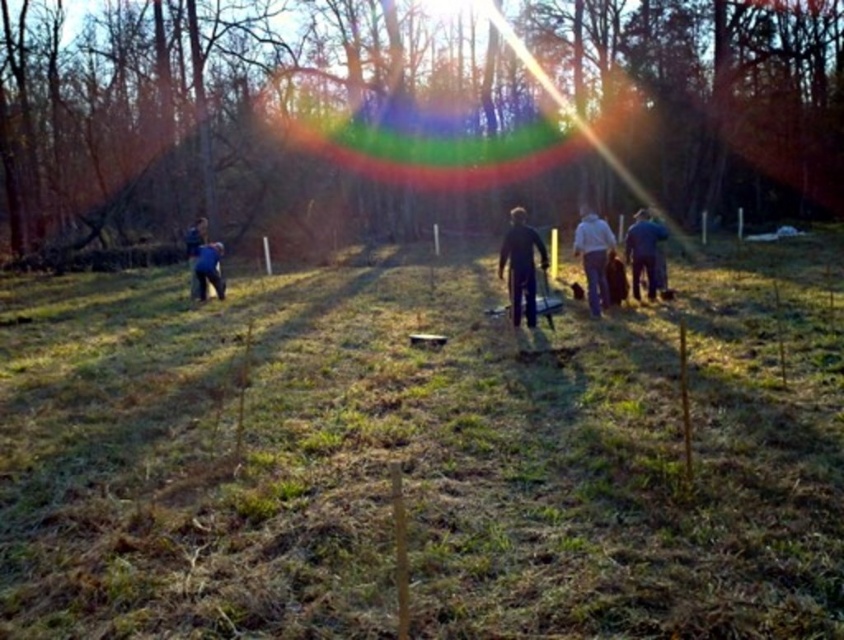
Is point (116, 573) farther from camera compared to point (464, 17)?

No, it is not.

This screenshot has height=640, width=844. What are the coordinates of `green grass at center` in the screenshot? It's located at (422, 456).

The height and width of the screenshot is (640, 844). I want to click on green grass at center, so click(x=422, y=456).

Is green matte tree at center thinner than white cotton shirt at center?

No.

Who is more forward, (377, 93) or (594, 216)?

Point (594, 216) is more forward.

You are a GUI agent. You are given a task and a screenshot of the screen. Output one action in this format:
    pyautogui.click(x=<x>, y=<y>)
    Task: Click on the green matte tree at center
    The height and width of the screenshot is (640, 844).
    Given the screenshot: What is the action you would take?
    pyautogui.click(x=412, y=113)

Does green grass at center have a greater width compared to blue fabric at left?

Correct, the width of green grass at center exceeds that of blue fabric at left.

Does point (464, 483) come in front of point (190, 237)?

Yes, point (464, 483) is in front of point (190, 237).

Is point (798, 524) closer to camera compared to point (193, 236)?

Yes, point (798, 524) is in front of point (193, 236).

Where is `green grass at center`? This screenshot has width=844, height=640. green grass at center is located at coordinates (422, 456).